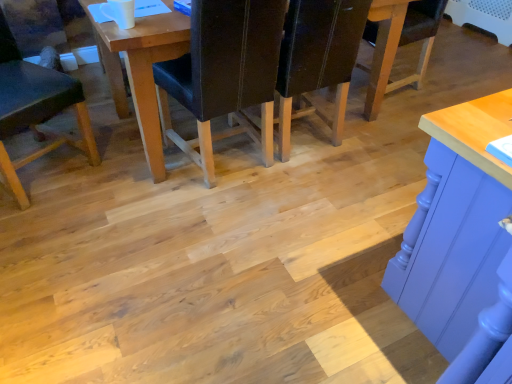
In order to click on vacant space in front of matte black chair at lower left, the third chair in the right-to-left sequence in this screenshot , I will do `click(42, 231)`.